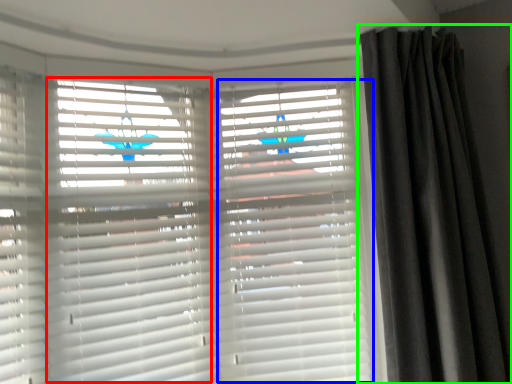
Question: Based on their relative distances, which object is nearer to shutter (highlighted by a red box)? Choose from shutter (highlighted by a blue box) and curtain (highlighted by a green box).

Choices:
 (A) shutter
 (B) curtain

Answer: (A)